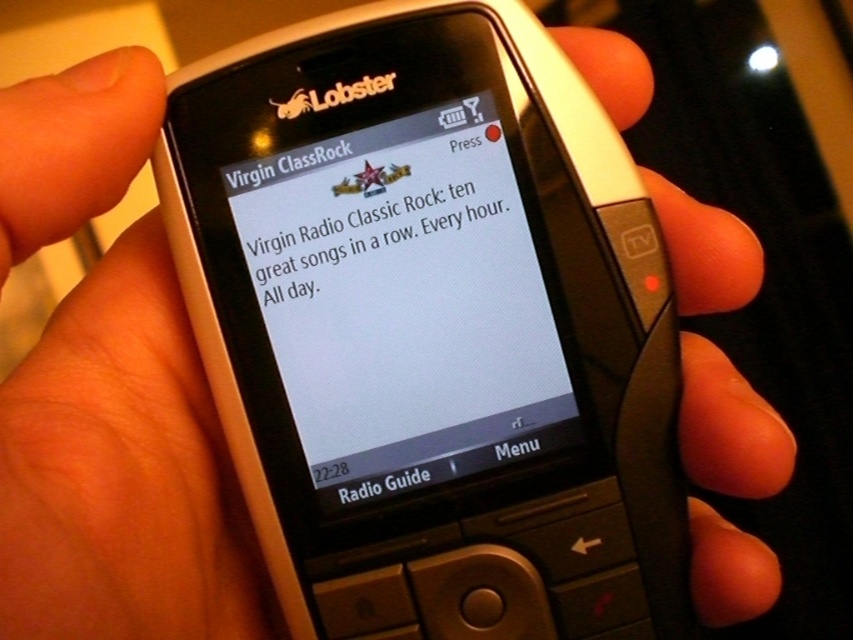
Question: Is matte black screen at center positioned in front of white glossy text at center?

Choices:
 (A) yes
 (B) no

Answer: (A)

Question: Which point appears closest to the camera in this image?

Choices:
 (A) (506, 188)
 (B) (469, 250)

Answer: (A)

Question: From the image, what is the correct spatial relationship of matte black screen at center in relation to white glossy text at center?

Choices:
 (A) below
 (B) above

Answer: (A)

Question: Can you confirm if matte black screen at center is bigger than white glossy text at center?

Choices:
 (A) no
 (B) yes

Answer: (B)